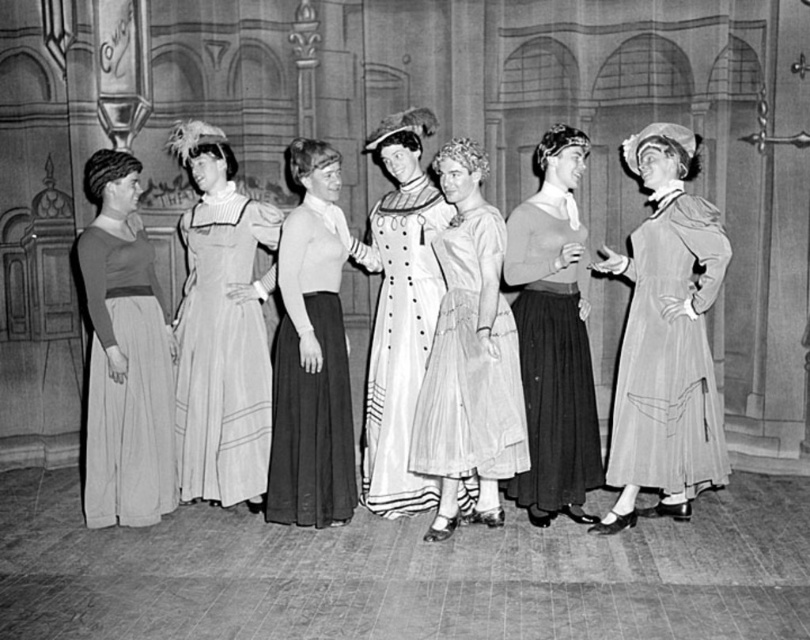
You are a costume designer looking at the stage setup. You notice two dresses at the center of the image. Which dress is positioned lower in the scene, the matte white dress at center or the white satin dress at center?

The matte white dress at center is positioned below the white satin dress at center, so it is lower in the scene.

You are a costume designer preparing for a play. You need to decide which dress to use for a scene where the character must move freely. Based on the image, which dress between the matte black dress at center and the white satin dress at center is more suitable for the character?

The matte black dress at center is thinner than the white satin dress at center, so it would allow for more freedom of movement, making it more suitable for the character needing to move freely.